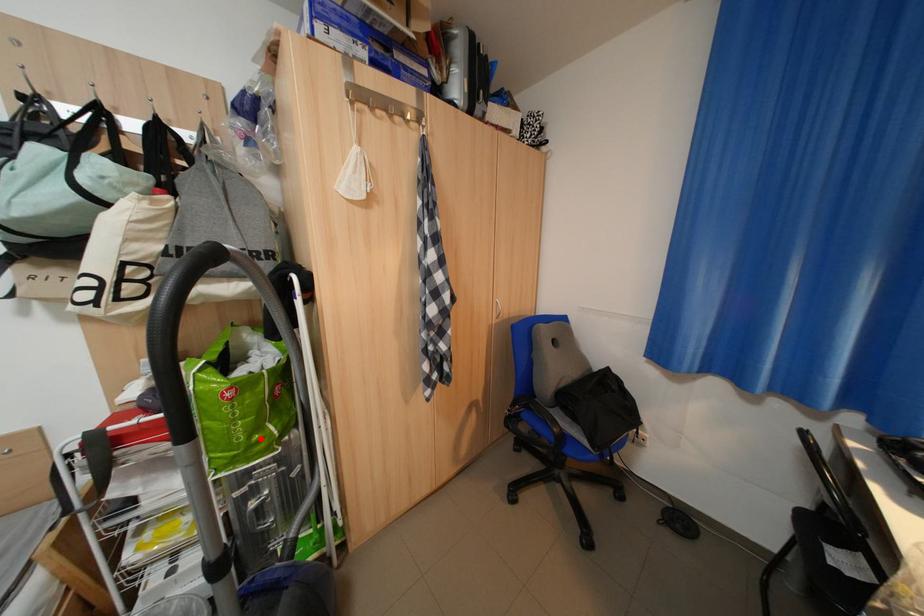
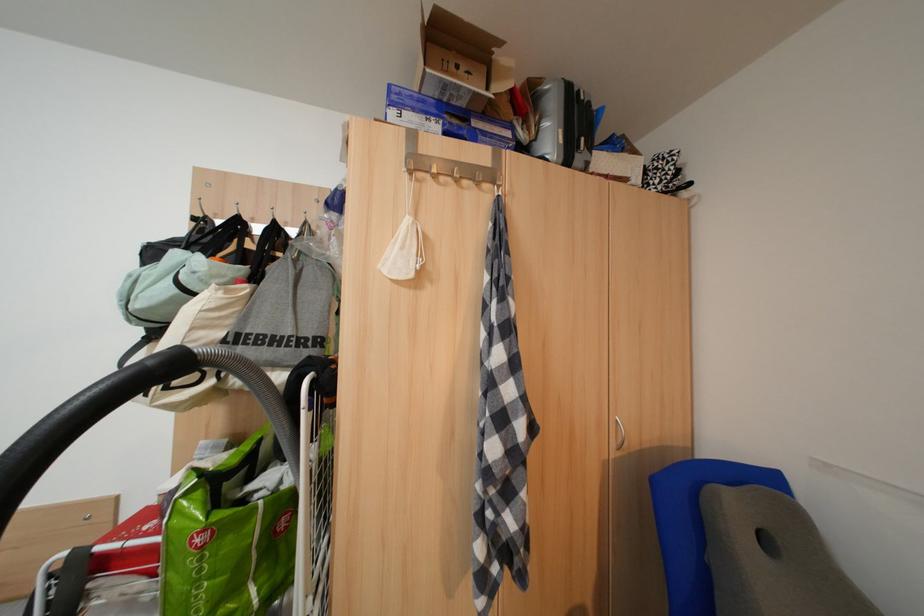
Question: A red point is marked in image1. In image2, is the corresponding 3D point closer to the camera or farther? Reply with the corresponding letter.

Choices:
 (A) The corresponding 3D point is closer.
 (B) The corresponding 3D point is farther.

Answer: (A)